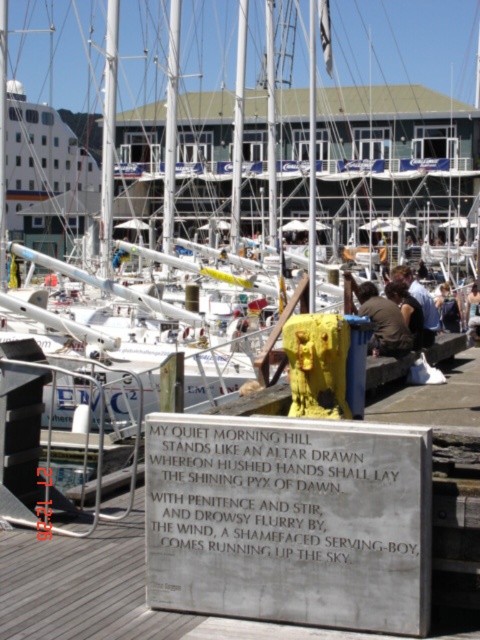
Is brown fabric at center taller than dark blue shirt at center?

No, brown fabric at center is not taller than dark blue shirt at center.

Is brown fabric at center below dark blue shirt at center?

Indeed, brown fabric at center is positioned under dark blue shirt at center.

Locate an element on the screen. This screenshot has height=640, width=480. brown fabric at center is located at coordinates (383, 321).

Identify the location of brown fabric at center. The height and width of the screenshot is (640, 480). (383, 321).

Between white glossy boat at center and light brown hair at center, which one is positioned lower?

light brown hair at center is lower down.

Is white glossy boat at center smaller than light brown hair at center?

No, white glossy boat at center is not smaller than light brown hair at center.

The image size is (480, 640). I want to click on white glossy boat at center, so 396,163.

Between silver polished stone plaque at center and dark blue shirt at center, which one is positioned higher?

dark blue shirt at center

Between silver polished stone plaque at center and dark blue shirt at center, which one appears on the left side from the viewer's perspective?

silver polished stone plaque at center

Is point (420, 522) behind point (434, 301)?

No.

This screenshot has width=480, height=640. I want to click on silver polished stone plaque at center, so click(x=289, y=520).